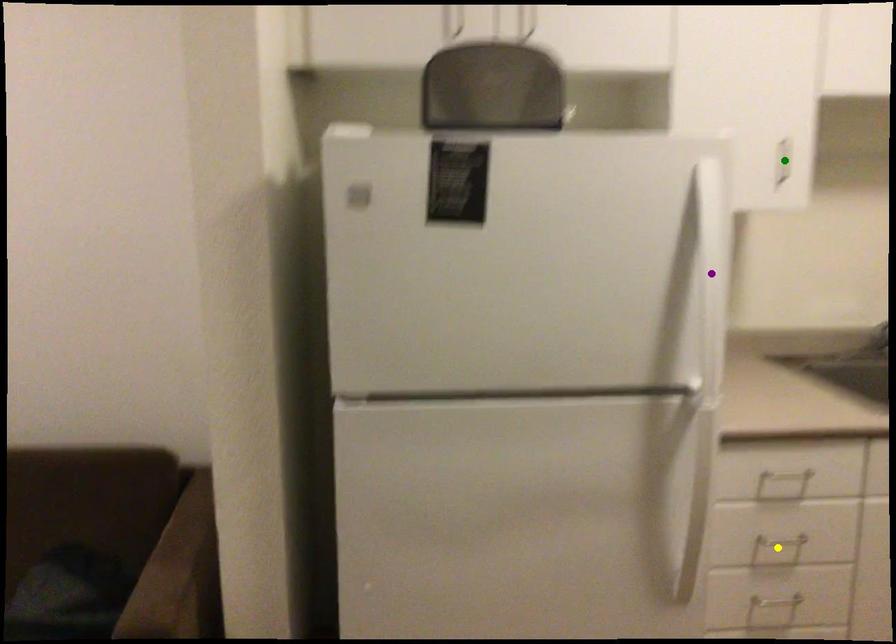
Based on the photo, order these from nearest to farthest:
purple point
green point
yellow point

1. purple point
2. yellow point
3. green point